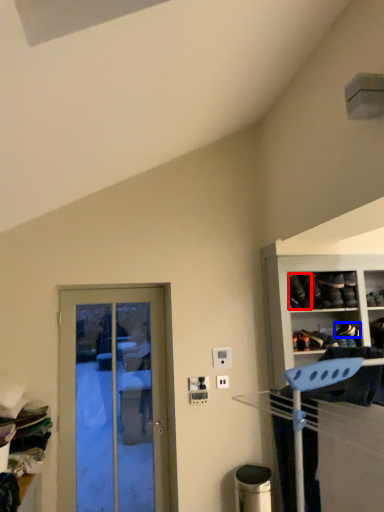
Question: Which object appears closest to the camera in this image, shoe (highlighted by a red box) or shoe (highlighted by a blue box)?

Choices:
 (A) shoe
 (B) shoe

Answer: (A)